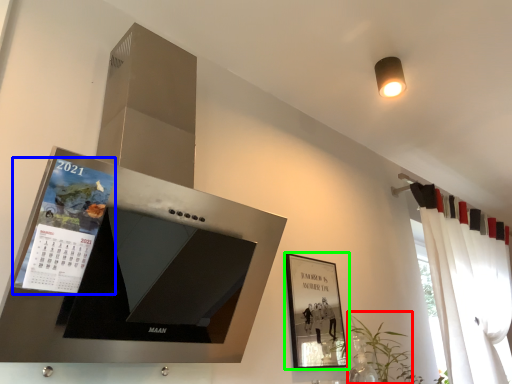
Question: Which object is positioned farthest from plant (highlighted by a red box)? Select from magazine (highlighted by a blue box) and picture frame (highlighted by a green box).

Choices:
 (A) magazine
 (B) picture frame

Answer: (A)